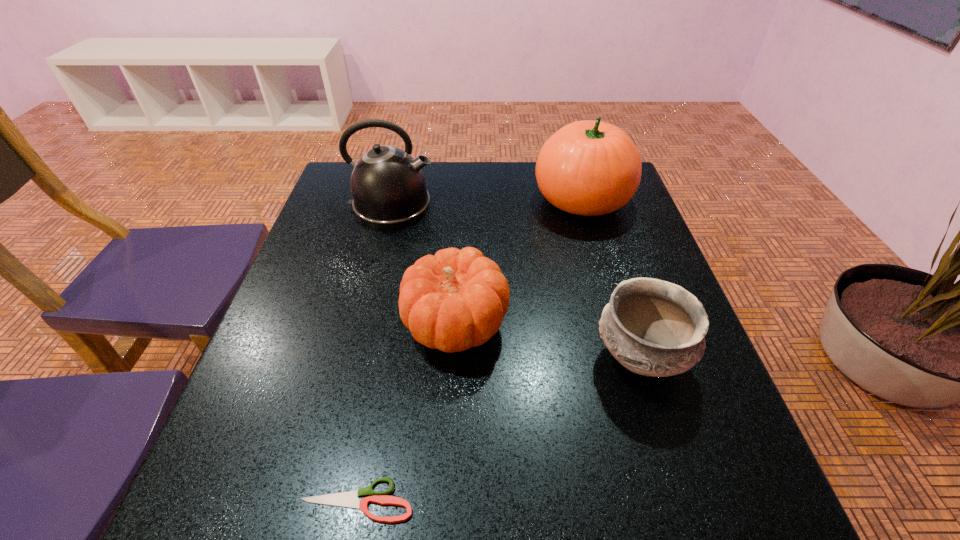
The height and width of the screenshot is (540, 960). Identify the location of free space that satisfies the following two spatial constraints: 1. on the spout of the pottery; 2. on the right side of the kettle. (354, 358).

Where is `blank space that satisfies the following two spatial constraints: 1. on the spout of the kettle; 2. on the right side of the scissors`? blank space that satisfies the following two spatial constraints: 1. on the spout of the kettle; 2. on the right side of the scissors is located at coordinates (319, 500).

Find the location of a particular element. The image size is (960, 540). free space that satisfies the following two spatial constraints: 1. on the back side of the shorter pumpkin; 2. on the right side of the farther pumpkin is located at coordinates (462, 199).

At what (x,y) coordinates should I click in order to perform the action: click on vacant space that satisfies the following two spatial constraints: 1. on the back side of the shorter pumpkin; 2. on the left side of the shortest object. Please return your answer as a coordinate pair (x, y). The width and height of the screenshot is (960, 540). Looking at the image, I should click on (390, 324).